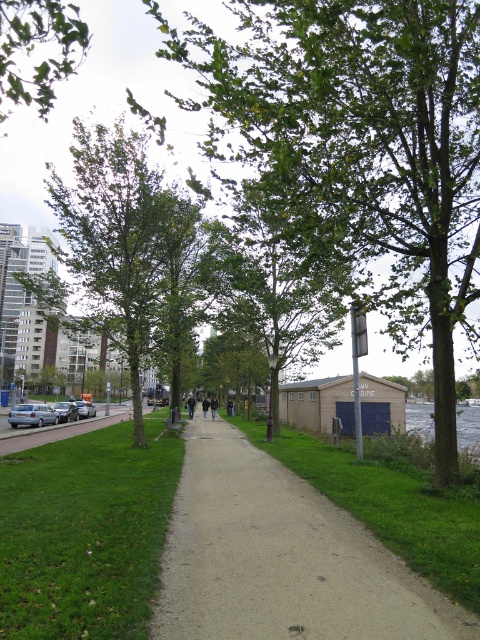
Question: Can you confirm if smooth concrete path at center is positioned to the left of green grass at lower left?

Choices:
 (A) yes
 (B) no

Answer: (B)

Question: Which of the following is the farthest from the observer?

Choices:
 (A) (168, 35)
 (B) (443, 620)
 (C) (52, 36)

Answer: (A)

Question: Which of these objects is positioned closest to the green leafy tree at center?

Choices:
 (A) silver metallic car at left
 (B) matte black car at left
 (C) smooth concrete path at center
 (D) green grass at lower left

Answer: (C)

Question: Is smooth concrete path at center closer to the viewer compared to green grass at lower left?

Choices:
 (A) no
 (B) yes

Answer: (A)

Question: Does smooth concrete path at center have a lesser width compared to silver metallic car at left?

Choices:
 (A) yes
 (B) no

Answer: (A)

Question: Which point is farther to the camera?

Choices:
 (A) matte black car at left
 (B) smooth concrete path at center
 (C) silver metallic car at left

Answer: (A)